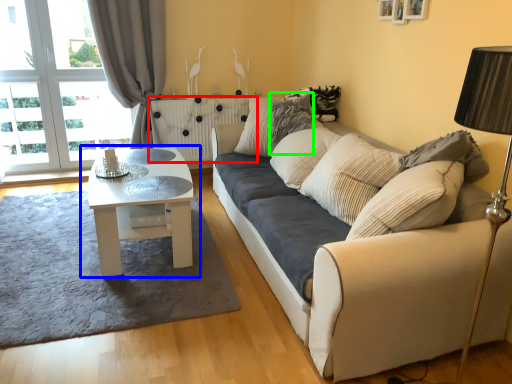
Question: Which is nearer to the radiator (highlighted by a red box)? coffee table (highlighted by a blue box) or pillow (highlighted by a green box).

Choices:
 (A) coffee table
 (B) pillow

Answer: (B)